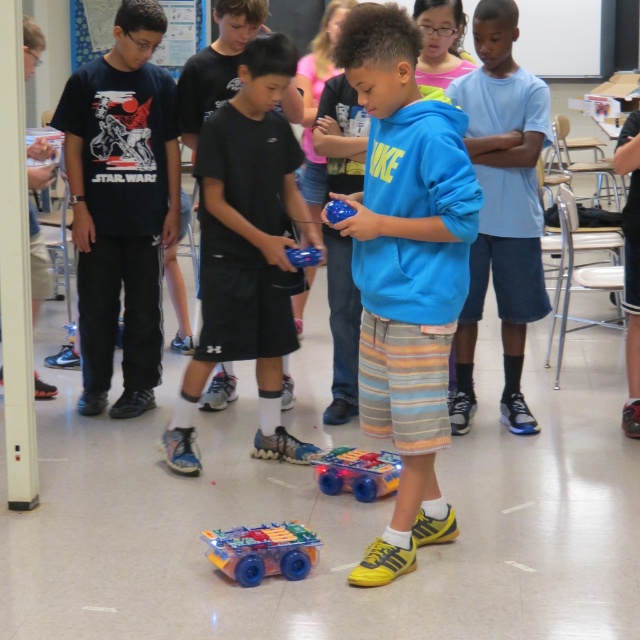
Who is more forward, (65, 134) or (364, 476)?

Positioned in front is point (364, 476).

Is black cotton t-shirt at left positioned in front of translucent plastic toy car at center?

No, black cotton t-shirt at left is further to the viewer.

Is point (97, 209) more distant than point (333, 461)?

Yes.

Identify the location of black cotton t-shirt at left. Image resolution: width=640 pixels, height=640 pixels. click(x=122, y=204).

Is blue fleece hoodie at center behind translucent plastic toy car at center?

That is False.

Is blue fleece hoodie at center to the right of translucent plastic toy car at center from the viewer's perspective?

Correct, you'll find blue fleece hoodie at center to the right of translucent plastic toy car at center.

Which is behind, point (387, 422) or point (378, 460)?

Positioned behind is point (378, 460).

Find the location of `blue fleece hoodie at center`. blue fleece hoodie at center is located at coordinates (404, 272).

Does black matte shorts at center have a lesser height compared to translucent plastic toy car at center?

No.

Is point (225, 131) more distant than point (323, 464)?

No, (225, 131) is closer to viewer.

Is point (228, 182) closer to camera compared to point (360, 486)?

No, it is not.

Find the location of a particular element. This screenshot has height=640, width=640. black matte shorts at center is located at coordinates (246, 250).